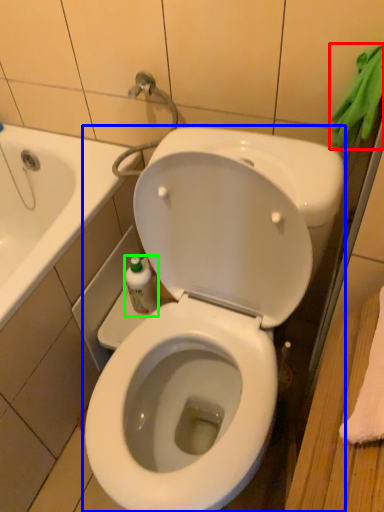
Question: Which object is the closest to the bath towel (highlighted by a red box)? Choose among these: toilet (highlighted by a blue box) or bottle (highlighted by a green box).

Choices:
 (A) toilet
 (B) bottle

Answer: (A)